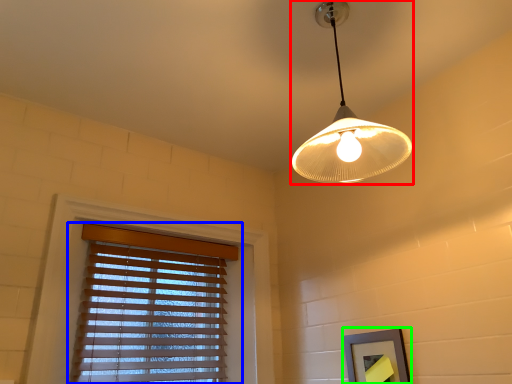
Question: Which object is positioned closest to lamp (highlighted by a red box)? Select from window blind (highlighted by a blue box) and picture frame (highlighted by a green box).

Choices:
 (A) window blind
 (B) picture frame

Answer: (B)